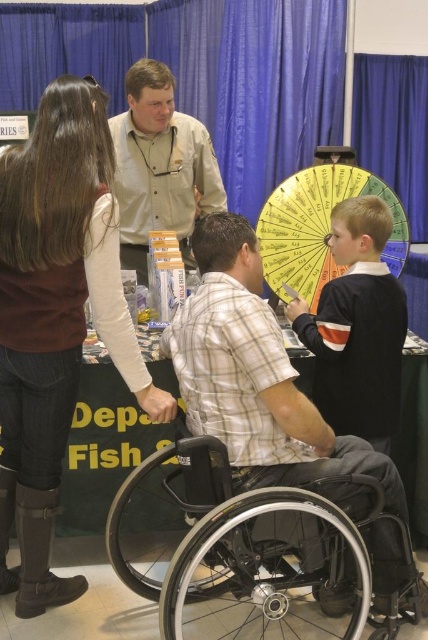
How much distance is there between black plastic wheelchair at lower center and khaki button-down shirt at center?

black plastic wheelchair at lower center is 1.38 meters from khaki button-down shirt at center.

Is point (344, 611) closer to camera compared to point (181, 145)?

Yes, point (344, 611) is closer to viewer.

At what (x,y) coordinates should I click in order to perform the action: click on black plastic wheelchair at lower center. Please return your answer as a coordinate pair (x, y). Looking at the image, I should click on (285, 547).

Describe the element at coordinates (255, 376) in the screenshot. I see `metallic silver wheelchair at center` at that location.

Is point (177, 323) positioned after point (243, 500)?

Yes, point (177, 323) is farther from viewer.

The height and width of the screenshot is (640, 428). Find the location of `metallic silver wheelchair at center`. metallic silver wheelchair at center is located at coordinates (255, 376).

Based on the photo, does brown leather boots at lower left have a greater width compared to metallic silver wheelchair at center?

No.

Who is positioned more to the right, brown leather boots at lower left or metallic silver wheelchair at center?

metallic silver wheelchair at center

What do you see at coordinates (56, 320) in the screenshot?
I see `brown leather boots at lower left` at bounding box center [56, 320].

The height and width of the screenshot is (640, 428). What are the coordinates of `brown leather boots at lower left` in the screenshot? It's located at (56, 320).